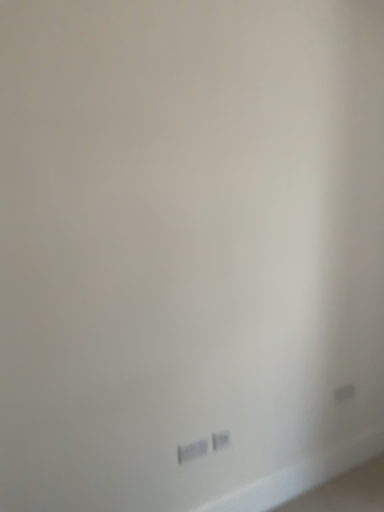
In order to face white plastic power plug at lower center, which is counted as the first power plugs and sockets, starting from the right, should I rotate leftwards or rightwards?

You should rotate right by 3.794 degrees.

Consider the image. How much space does white plastic power plug at lower center, which is counted as the first power plugs and sockets, starting from the right, occupy horizontally?

It is 0.93 inches.

Find the location of a particular element. The image size is (384, 512). white plastic power plug at lower center, positioned as the 1th power plugs and sockets in back-to-front order is located at coordinates (220, 440).

Describe the element at coordinates (220, 440) in the screenshot. I see `white plastic power plug at lower center, which is counted as the first power plugs and sockets, starting from the right` at that location.

The image size is (384, 512). What are the coordinates of `white plastic power plugs and sockets at lower center, the 1th power plugs and sockets when ordered from front to back` in the screenshot? It's located at (192, 451).

The image size is (384, 512). What do you see at coordinates (192, 451) in the screenshot?
I see `white plastic power plugs and sockets at lower center, which is the 2th power plugs and sockets in back-to-front order` at bounding box center [192, 451].

The width and height of the screenshot is (384, 512). In order to click on white plastic power plug at lower center, the second power plugs and sockets viewed from the left in this screenshot , I will do `click(220, 440)`.

Which is more to the left, white plastic power plug at lower center, positioned as the 1th power plugs and sockets in back-to-front order, or white plastic power plugs and sockets at lower center, which is counted as the second power plugs and sockets, starting from the right?

white plastic power plugs and sockets at lower center, which is counted as the second power plugs and sockets, starting from the right, is more to the left.

Does white plastic power plug at lower center, which is counted as the first power plugs and sockets, starting from the right, lie behind white plastic power plugs and sockets at lower center, the 1th power plugs and sockets when ordered from front to back?

That is True.

Is point (223, 434) farther from viewer compared to point (198, 442)?

Yes, point (223, 434) is farther from viewer.

From the image's perspective, would you say white plastic power plug at lower center, positioned as the 1th power plugs and sockets in back-to-front order, is positioned over white plastic power plugs and sockets at lower center, the 1th power plugs and sockets in the left-to-right sequence?

Yes, from the image's perspective, white plastic power plug at lower center, positioned as the 1th power plugs and sockets in back-to-front order, is above white plastic power plugs and sockets at lower center, the 1th power plugs and sockets in the left-to-right sequence.

From a real-world perspective, is white plastic power plug at lower center, the second power plugs and sockets viewed from the left, physically below white plastic power plugs and sockets at lower center, the 1th power plugs and sockets when ordered from front to back?

No, from a real-world perspective, white plastic power plug at lower center, the second power plugs and sockets viewed from the left, is not under white plastic power plugs and sockets at lower center, the 1th power plugs and sockets when ordered from front to back.

Is white plastic power plug at lower center, arranged as the 2th power plugs and sockets when viewed from the front, thinner than white plastic power plugs and sockets at lower center, the 1th power plugs and sockets when ordered from front to back?

Yes.

From their relative heights in the image, would you say white plastic power plug at lower center, positioned as the 1th power plugs and sockets in back-to-front order, is taller or shorter than white plastic power plugs and sockets at lower center, the 1th power plugs and sockets when ordered from front to back?

white plastic power plug at lower center, positioned as the 1th power plugs and sockets in back-to-front order, is taller than white plastic power plugs and sockets at lower center, the 1th power plugs and sockets when ordered from front to back.

Who is smaller, white plastic power plug at lower center, the second power plugs and sockets viewed from the left, or white plastic power plugs and sockets at lower center, the 1th power plugs and sockets in the left-to-right sequence?

Smaller between the two is white plastic power plug at lower center, the second power plugs and sockets viewed from the left.

Can we say white plastic power plug at lower center, which is counted as the first power plugs and sockets, starting from the right, lies outside white plastic power plugs and sockets at lower center, the 1th power plugs and sockets in the left-to-right sequence?

white plastic power plug at lower center, which is counted as the first power plugs and sockets, starting from the right, is positioned outside white plastic power plugs and sockets at lower center, the 1th power plugs and sockets in the left-to-right sequence.

Does white plastic power plug at lower center, which is counted as the first power plugs and sockets, starting from the right, touch white plastic power plugs and sockets at lower center, which is counted as the second power plugs and sockets, starting from the right?

Absolutely, white plastic power plug at lower center, which is counted as the first power plugs and sockets, starting from the right, is next to and touching white plastic power plugs and sockets at lower center, which is counted as the second power plugs and sockets, starting from the right.

Is white plastic power plug at lower center, the second power plugs and sockets viewed from the left, aimed at white plastic power plugs and sockets at lower center, which is counted as the second power plugs and sockets, starting from the right?

No, white plastic power plug at lower center, the second power plugs and sockets viewed from the left, is not turned towards white plastic power plugs and sockets at lower center, which is counted as the second power plugs and sockets, starting from the right.

How different are the orientations of white plastic power plug at lower center, arranged as the 2th power plugs and sockets when viewed from the front, and white plastic power plugs and sockets at lower center, which is counted as the second power plugs and sockets, starting from the right, in degrees?

The angle between the facing direction of white plastic power plug at lower center, arranged as the 2th power plugs and sockets when viewed from the front, and the facing direction of white plastic power plugs and sockets at lower center, which is counted as the second power plugs and sockets, starting from the right, is 4.49 degrees.

Identify the location of power plugs and sockets beneath the white plastic power plug at lower center, the second power plugs and sockets viewed from the left (from a real-world perspective). This screenshot has height=512, width=384. (192, 451).

Considering the relative positions of white plastic power plugs and sockets at lower center, the 1th power plugs and sockets in the left-to-right sequence, and white plastic power plug at lower center, the second power plugs and sockets viewed from the left, in the image provided, is white plastic power plugs and sockets at lower center, the 1th power plugs and sockets in the left-to-right sequence, to the left of white plastic power plug at lower center, the second power plugs and sockets viewed from the left, from the viewer's perspective?

Correct, you'll find white plastic power plugs and sockets at lower center, the 1th power plugs and sockets in the left-to-right sequence, to the left of white plastic power plug at lower center, the second power plugs and sockets viewed from the left.

Who is more distant, white plastic power plugs and sockets at lower center, which is the 2th power plugs and sockets in back-to-front order, or white plastic power plug at lower center, positioned as the 1th power plugs and sockets in back-to-front order?

white plastic power plug at lower center, positioned as the 1th power plugs and sockets in back-to-front order, is more distant.

Is point (194, 453) positioned in front of point (220, 434)?

Yes.

From the image's perspective, is white plastic power plugs and sockets at lower center, which is the 2th power plugs and sockets in back-to-front order, over white plastic power plug at lower center, arranged as the 2th power plugs and sockets when viewed from the front?

Actually, white plastic power plugs and sockets at lower center, which is the 2th power plugs and sockets in back-to-front order, appears below white plastic power plug at lower center, arranged as the 2th power plugs and sockets when viewed from the front, in the image.

From a real-world perspective, which is physically below, white plastic power plugs and sockets at lower center, the 1th power plugs and sockets in the left-to-right sequence, or white plastic power plug at lower center, the second power plugs and sockets viewed from the left?

From a 3D spatial view, white plastic power plugs and sockets at lower center, the 1th power plugs and sockets in the left-to-right sequence, is below.

Which of these two, white plastic power plugs and sockets at lower center, which is counted as the second power plugs and sockets, starting from the right, or white plastic power plug at lower center, the second power plugs and sockets viewed from the left, is thinner?

white plastic power plug at lower center, the second power plugs and sockets viewed from the left.

Does white plastic power plugs and sockets at lower center, the 1th power plugs and sockets in the left-to-right sequence, have a lesser height compared to white plastic power plug at lower center, which is counted as the first power plugs and sockets, starting from the right?

Indeed, white plastic power plugs and sockets at lower center, the 1th power plugs and sockets in the left-to-right sequence, has a lesser height compared to white plastic power plug at lower center, which is counted as the first power plugs and sockets, starting from the right.

Considering the relative sizes of white plastic power plugs and sockets at lower center, the 1th power plugs and sockets when ordered from front to back, and white plastic power plug at lower center, positioned as the 1th power plugs and sockets in back-to-front order, in the image provided, is white plastic power plugs and sockets at lower center, the 1th power plugs and sockets when ordered from front to back, bigger than white plastic power plug at lower center, positioned as the 1th power plugs and sockets in back-to-front order,?

Yes, white plastic power plugs and sockets at lower center, the 1th power plugs and sockets when ordered from front to back, is bigger than white plastic power plug at lower center, positioned as the 1th power plugs and sockets in back-to-front order.

Is white plastic power plug at lower center, which is counted as the first power plugs and sockets, starting from the right, completely or partially inside white plastic power plugs and sockets at lower center, which is the 2th power plugs and sockets in back-to-front order?

No, white plastic power plug at lower center, which is counted as the first power plugs and sockets, starting from the right, is not a part of white plastic power plugs and sockets at lower center, which is the 2th power plugs and sockets in back-to-front order.

Is there a large distance between white plastic power plugs and sockets at lower center, which is counted as the second power plugs and sockets, starting from the right, and white plastic power plug at lower center, the second power plugs and sockets viewed from the left?

No, white plastic power plugs and sockets at lower center, which is counted as the second power plugs and sockets, starting from the right, is in close proximity to white plastic power plug at lower center, the second power plugs and sockets viewed from the left.

Is white plastic power plugs and sockets at lower center, which is the 2th power plugs and sockets in back-to-front order, facing towards white plastic power plug at lower center, which is counted as the first power plugs and sockets, starting from the right?

No, white plastic power plugs and sockets at lower center, which is the 2th power plugs and sockets in back-to-front order, is not oriented towards white plastic power plug at lower center, which is counted as the first power plugs and sockets, starting from the right.

How different are the orientations of white plastic power plugs and sockets at lower center, which is the 2th power plugs and sockets in back-to-front order, and white plastic power plug at lower center, the second power plugs and sockets viewed from the left, in degrees?

white plastic power plugs and sockets at lower center, which is the 2th power plugs and sockets in back-to-front order, and white plastic power plug at lower center, the second power plugs and sockets viewed from the left, are facing 4.49 degrees away from each other.

You are a GUI agent. You are given a task and a screenshot of the screen. Output one action in this format:
    pyautogui.click(x=<x>, y=<y>)
    Task: Click on the power plugs and sockets that appears below the white plastic power plug at lower center, the second power plugs and sockets viewed from the left (from a real-world perspective)
    The image size is (384, 512).
    Given the screenshot: What is the action you would take?
    pyautogui.click(x=192, y=451)

In order to click on power plugs and sockets to the right of white plastic power plugs and sockets at lower center, the 1th power plugs and sockets when ordered from front to back in this screenshot , I will do `click(220, 440)`.

This screenshot has height=512, width=384. Identify the location of power plugs and sockets that appears in front of the white plastic power plug at lower center, arranged as the 2th power plugs and sockets when viewed from the front. (192, 451).